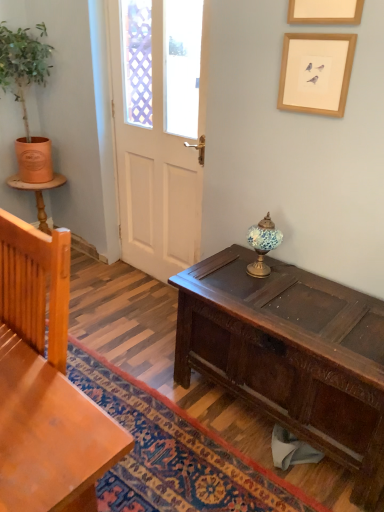
Locate an element on the screen. The height and width of the screenshot is (512, 384). empty space that is ontop of dark brown wood desk at center (from a real-world perspective) is located at coordinates (296, 298).